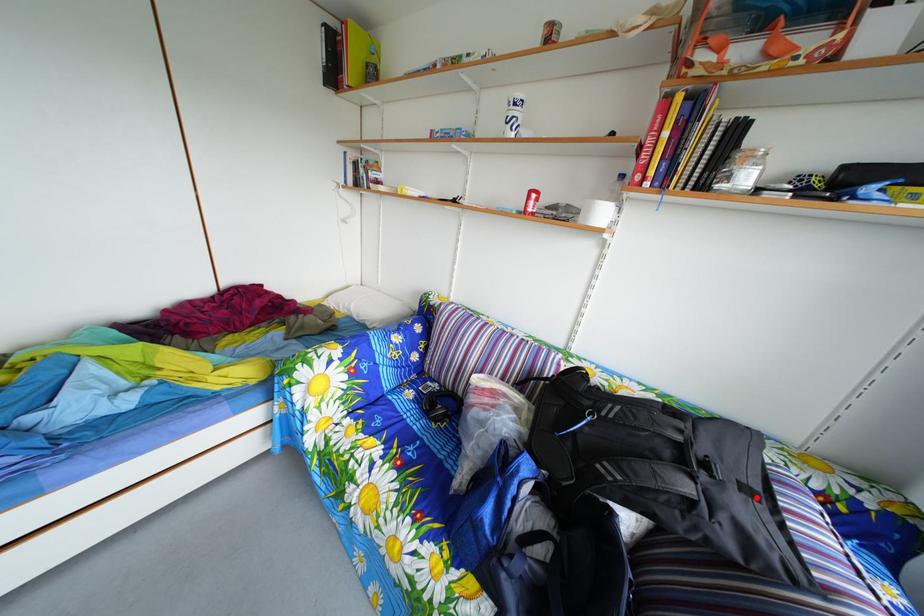
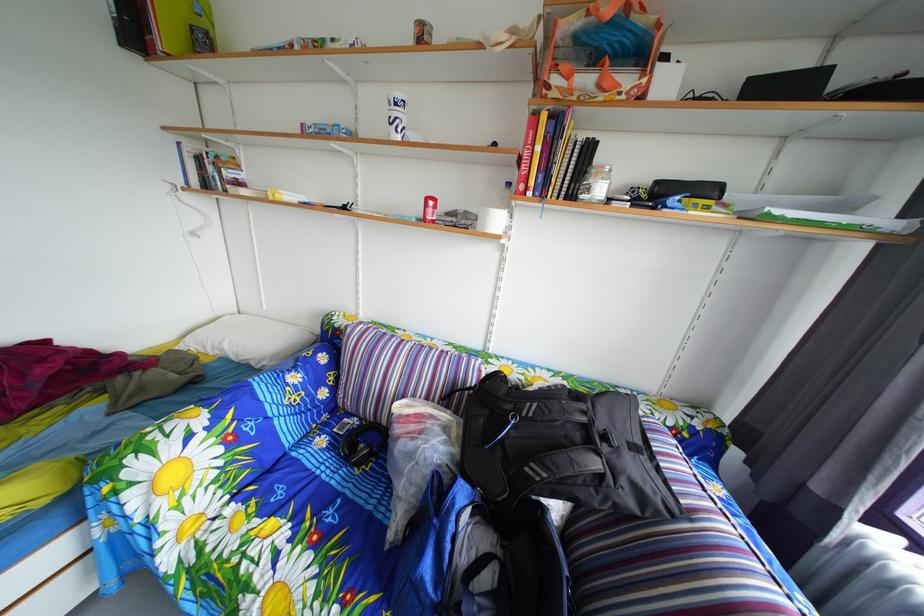
Find the pixel in the second image that matches the highlighted location in the first image.

(643, 456)